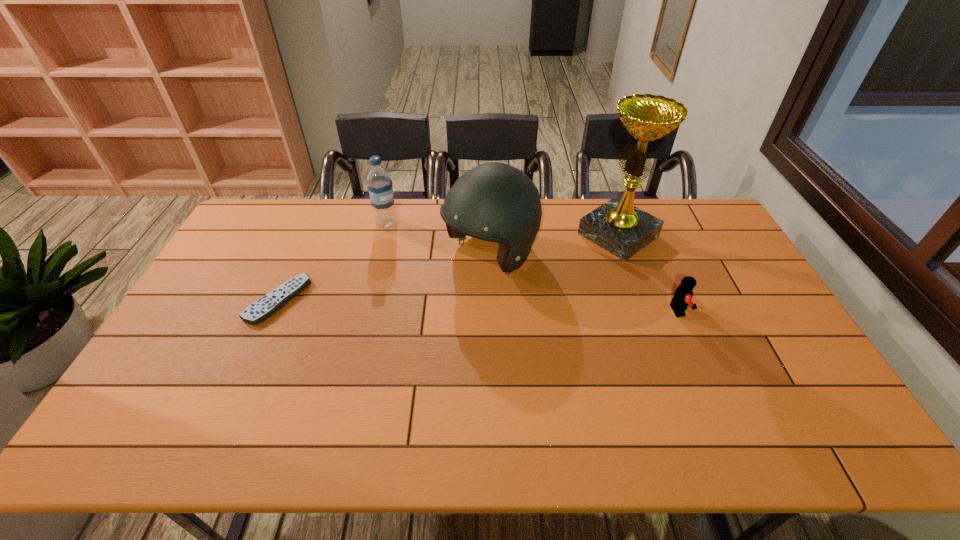
The image size is (960, 540). Identify the location of vacant space on the desktop that is between the remote control and the second shortest object and is positioned on the front-facing side of the award. (516, 306).

At what (x,y) coordinates should I click in order to perform the action: click on free space on the desktop that is between the leftmost object and the Lego and is positioned at the face opening of the third object from right to left. Please return your answer as a coordinate pair (x, y). Image resolution: width=960 pixels, height=540 pixels. Looking at the image, I should click on (418, 304).

The image size is (960, 540). I want to click on vacant space on the desktop that is between the shortest object and the second shortest object and is positioned on the label of the fourth object from right to left, so click(x=437, y=304).